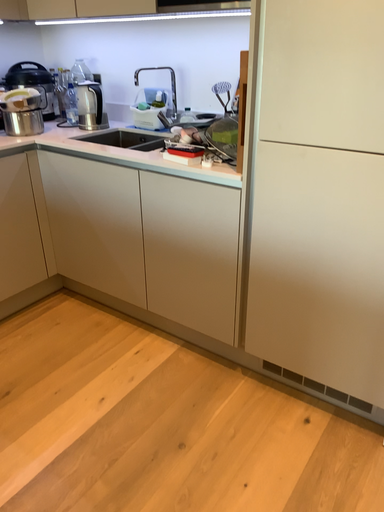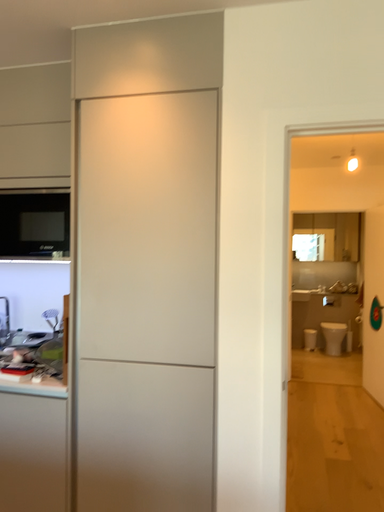
Question: How did the camera likely rotate when shooting the video?

Choices:
 (A) rotated right
 (B) rotated left

Answer: (A)